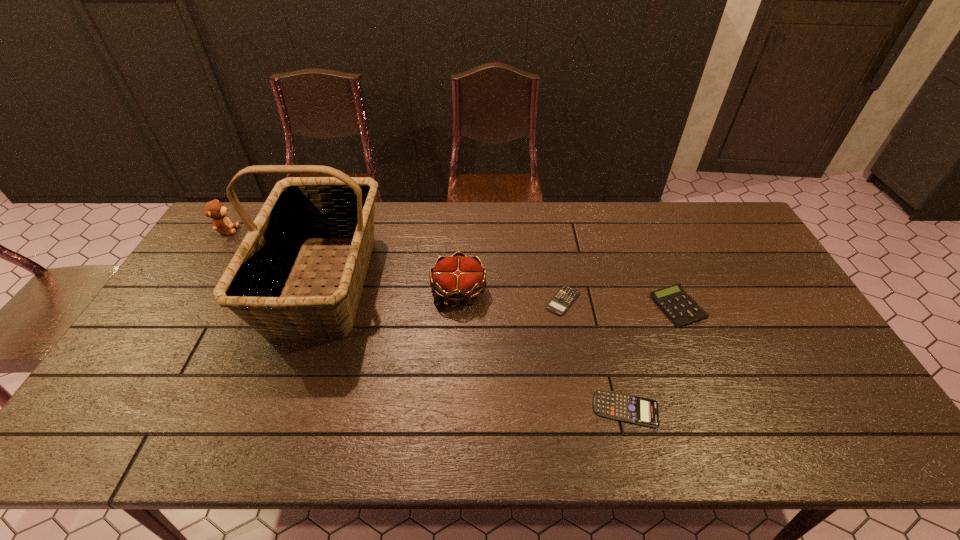
Locate an element on the screen. The height and width of the screenshot is (540, 960). basket is located at coordinates (299, 211).

Identify the location of the fifth object from right to left. (299, 211).

Where is `the fifth shortest object`? The height and width of the screenshot is (540, 960). the fifth shortest object is located at coordinates (214, 209).

Locate an element on the screen. Image resolution: width=960 pixels, height=540 pixels. teddy bear is located at coordinates (214, 209).

This screenshot has height=540, width=960. In order to click on the fourth object from right to left in this screenshot , I will do `click(458, 278)`.

Where is `crown`? The image size is (960, 540). crown is located at coordinates (458, 278).

Find the location of a particular element. The width and height of the screenshot is (960, 540). the rightmost calculator is located at coordinates click(x=678, y=306).

The width and height of the screenshot is (960, 540). Identify the location of the third shortest object. (678, 306).

Locate an element on the screen. the nearest calculator is located at coordinates click(x=638, y=410).

You are a GUI agent. You are given a task and a screenshot of the screen. Output one action in this format:
    pyautogui.click(x=<x>, y=<y>)
    Task: Click on the second shortest calculator
    The image size is (960, 540).
    Given the screenshot: What is the action you would take?
    pyautogui.click(x=638, y=410)